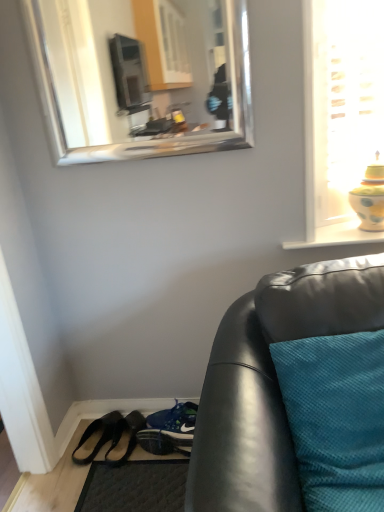
Question: From the image's perspective, does black leather shoes at lower left, positioned as the second footwear in left-to-right order, appear lower than black leather shoes at lower left, which is counted as the 1th footwear, starting from the left?

Choices:
 (A) no
 (B) yes

Answer: (A)

Question: Is black leather shoes at lower left, which appears as the first footwear when viewed from the right, far away from black leather shoes at lower left, which is counted as the 1th footwear, starting from the left?

Choices:
 (A) no
 (B) yes

Answer: (A)

Question: Considering the relative sizes of black leather shoes at lower left, which appears as the first footwear when viewed from the right, and black leather shoes at lower left, which is counted as the 1th footwear, starting from the left, in the image provided, is black leather shoes at lower left, which appears as the first footwear when viewed from the right, thinner than black leather shoes at lower left, which is counted as the 1th footwear, starting from the left,?

Choices:
 (A) no
 (B) yes

Answer: (B)

Question: Does black leather shoes at lower left, which appears as the first footwear when viewed from the right, have a larger size compared to black leather shoes at lower left, which ranks as the second footwear in right-to-left order?

Choices:
 (A) yes
 (B) no

Answer: (B)

Question: Is black leather shoes at lower left, which appears as the first footwear when viewed from the right, taller than black leather shoes at lower left, which ranks as the second footwear in right-to-left order?

Choices:
 (A) yes
 (B) no

Answer: (B)

Question: Considering the positions of point (178, 410) and point (89, 141), is point (178, 410) closer or farther from the camera than point (89, 141)?

Choices:
 (A) closer
 (B) farther

Answer: (A)

Question: Which is correct: blue fabric shoe at lower center, which appears as the 2th shoe when viewed from the front, is inside silver/metallic mirror at upper center, or outside of it?

Choices:
 (A) outside
 (B) inside

Answer: (A)

Question: In terms of height, does blue fabric shoe at lower center, which appears as the 2th shoe when viewed from the front, look taller or shorter compared to silver/metallic mirror at upper center?

Choices:
 (A) tall
 (B) short

Answer: (B)

Question: Based on their sizes in the image, would you say blue fabric shoe at lower center, the 1th shoe positioned from the back, is bigger or smaller than silver/metallic mirror at upper center?

Choices:
 (A) small
 (B) big

Answer: (A)

Question: Is black leather shoes at lower left, which is counted as the 1th footwear, starting from the left, in front of or behind silver/metallic mirror at upper center in the image?

Choices:
 (A) behind
 (B) front

Answer: (A)

Question: In terms of width, does black leather shoes at lower left, which is counted as the 1th footwear, starting from the left, look wider or thinner when compared to silver/metallic mirror at upper center?

Choices:
 (A) wide
 (B) thin

Answer: (A)

Question: In terms of height, does black leather shoes at lower left, which ranks as the second footwear in right-to-left order, look taller or shorter compared to silver/metallic mirror at upper center?

Choices:
 (A) short
 (B) tall

Answer: (A)

Question: From a real-world perspective, is black leather shoes at lower left, which ranks as the second footwear in right-to-left order, above or below silver/metallic mirror at upper center?

Choices:
 (A) above
 (B) below

Answer: (B)

Question: From the image's perspective, is black leather shoes at lower left, positioned as the second footwear in left-to-right order, above or below dark gray textured mat at lower left?

Choices:
 (A) above
 (B) below

Answer: (A)

Question: From a real-world perspective, is black leather shoes at lower left, which appears as the first footwear when viewed from the right, above or below dark gray textured mat at lower left?

Choices:
 (A) below
 (B) above

Answer: (B)